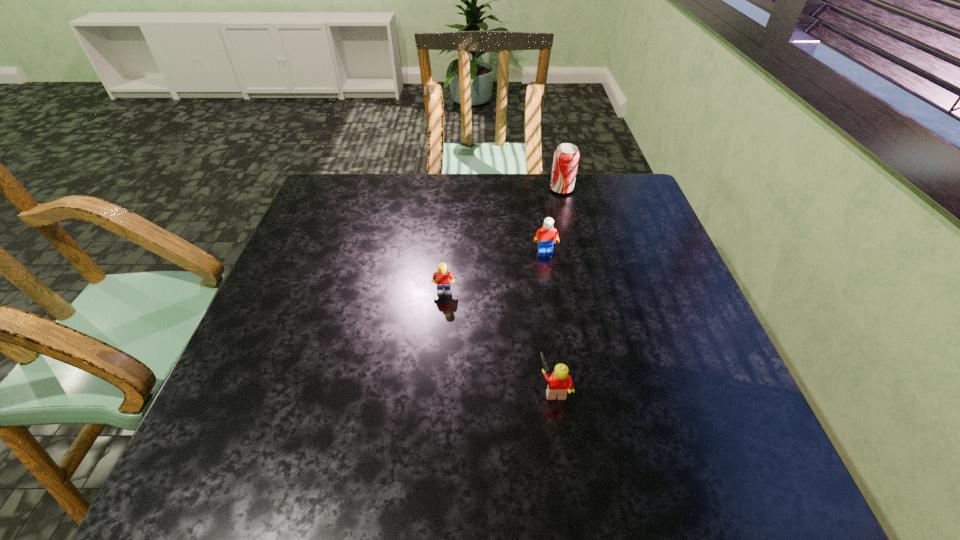
Where is `soda can`? The image size is (960, 540). soda can is located at coordinates (566, 156).

Identify the location of the tallest object. The height and width of the screenshot is (540, 960). (566, 156).

Where is `the third nearest object`? the third nearest object is located at coordinates (546, 236).

You are a GUI agent. You are given a task and a screenshot of the screen. Output one action in this format:
    pyautogui.click(x=<x>, y=<y>)
    Task: Click on the nearest object
    The image size is (960, 540).
    Given the screenshot: What is the action you would take?
    pyautogui.click(x=559, y=382)

The width and height of the screenshot is (960, 540). I want to click on the third farthest object, so click(x=443, y=278).

The width and height of the screenshot is (960, 540). I want to click on the leftmost Lego, so click(443, 278).

Where is `free space located 0.330m on the logo side of the tallest object`? The image size is (960, 540). free space located 0.330m on the logo side of the tallest object is located at coordinates (447, 190).

At what (x,y) coordinates should I click in order to perform the action: click on free region located on the logo side of the tallest object. Please return your answer as a coordinate pair (x, y). Looking at the image, I should click on (522, 190).

You are a GUI agent. You are given a task and a screenshot of the screen. Output one action in this format:
    pyautogui.click(x=<x>, y=<y>)
    Task: Click on the vacant space located on the logo side of the tallest object
    
    Given the screenshot: What is the action you would take?
    pyautogui.click(x=444, y=190)

Where is `free spot located on the face of the third nearest object`? free spot located on the face of the third nearest object is located at coordinates (563, 354).